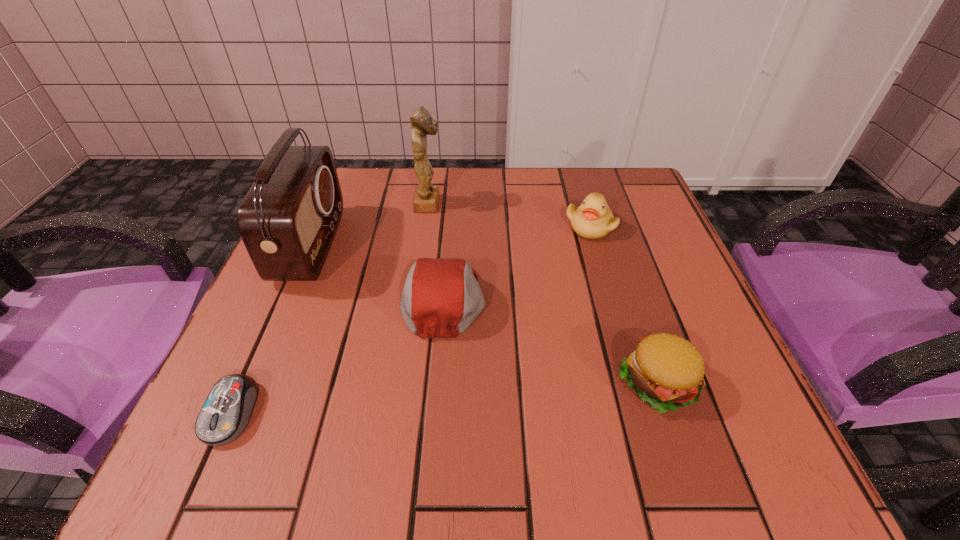
Find the location of a particular element. This screenshot has width=960, height=540. blank region between the cap and the figurine is located at coordinates (437, 251).

Find the location of a particular element. Image resolution: width=960 pixels, height=540 pixels. vacant region between the computer mouse and the hamburger is located at coordinates (444, 397).

The image size is (960, 540). In order to click on vacant point located between the radio receiver and the shortest object in this screenshot , I will do `click(271, 329)`.

Where is `unoccupied area between the shortest object and the hamburger`? unoccupied area between the shortest object and the hamburger is located at coordinates (444, 397).

Where is `vacant space that's between the cap and the duckling`? This screenshot has height=540, width=960. vacant space that's between the cap and the duckling is located at coordinates (516, 263).

Locate an element on the screen. The width and height of the screenshot is (960, 540). vacant region between the hamburger and the figurine is located at coordinates (542, 293).

Identify the location of vacant area between the figurine and the radio receiver. [x=370, y=225].

Identify the location of empty space that is in between the duckling and the figurine. This screenshot has height=540, width=960. pyautogui.click(x=510, y=215).

In order to click on vacant space that is in between the shortest object and the radio receiver in this screenshot , I will do `click(271, 329)`.

This screenshot has height=540, width=960. In order to click on the fourth closest object to the cap in this screenshot , I will do `click(226, 412)`.